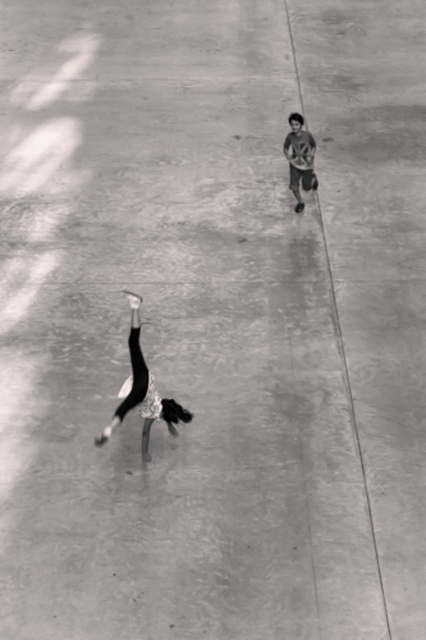
Measure the distance between point [135,376] and camera.

A distance of 8.00 meters exists between point [135,376] and camera.

Who is higher up, black fabric child at center or matte gray shirt at upper right?

Positioned higher is matte gray shirt at upper right.

Is point (146, 416) closer to camera compared to point (298, 160)?

Yes, it is.

The height and width of the screenshot is (640, 426). I want to click on black fabric child at center, so pyautogui.click(x=141, y=392).